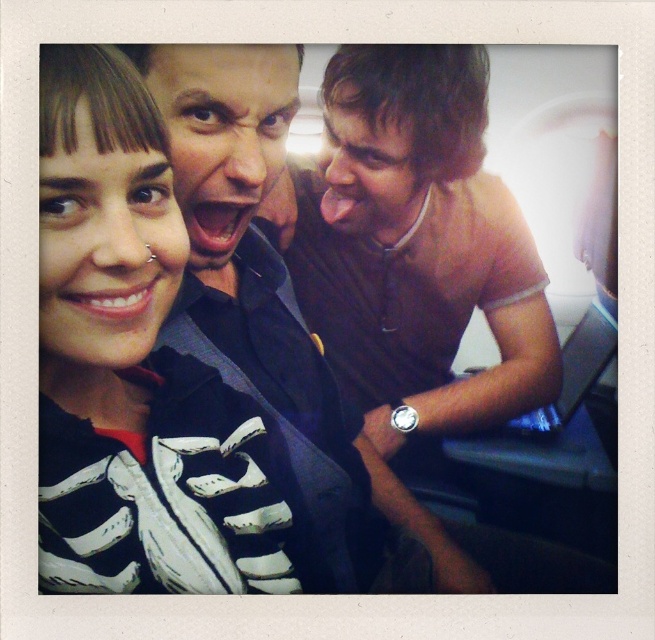
Question: Is matte black skeleton shirt at upper left wider than brown fabric shirt at right?

Choices:
 (A) no
 (B) yes

Answer: (A)

Question: Considering the relative positions of matte black skeleton shirt at upper left and brown fabric shirt at right in the image provided, where is matte black skeleton shirt at upper left located with respect to brown fabric shirt at right?

Choices:
 (A) left
 (B) right

Answer: (A)

Question: Which point appears closest to the camera in this image?

Choices:
 (A) (124, 339)
 (B) (346, 288)

Answer: (A)

Question: In this image, where is matte black skeleton shirt at upper left located relative to brown fabric shirt at right?

Choices:
 (A) below
 (B) above

Answer: (A)

Question: Which of the following is the farthest from the observer?

Choices:
 (A) (432, 129)
 (B) (47, 99)

Answer: (A)

Question: Which of the following is the farthest from the observer?

Choices:
 (A) (174, 518)
 (B) (303, 307)

Answer: (B)